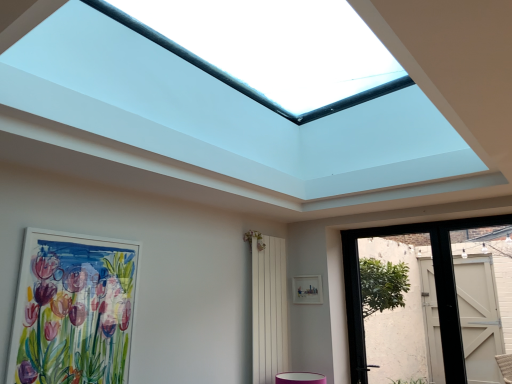
Question: Can you confirm if white matte picture frame at center, placed as the second picture frame when sorted from left to right, is wider than white painted wood door at right, which is counted as the second door, starting from the left?

Choices:
 (A) no
 (B) yes

Answer: (A)

Question: Is the position of white matte picture frame at center, placed as the second picture frame when sorted from left to right, more distant than that of white painted wood door at right, the first door positioned from the right?

Choices:
 (A) no
 (B) yes

Answer: (B)

Question: Does white matte picture frame at center, placed as the second picture frame when sorted from left to right, have a greater height compared to white painted wood door at right, the first door positioned from the right?

Choices:
 (A) yes
 (B) no

Answer: (B)

Question: Is white painted wood door at right, which is counted as the second door, starting from the left, a part of white matte picture frame at center, the second picture frame positioned from the front?

Choices:
 (A) no
 (B) yes

Answer: (A)

Question: Is white matte picture frame at center, the first picture frame viewed from the back, thinner than white painted wood door at right, which is counted as the second door, starting from the left?

Choices:
 (A) yes
 (B) no

Answer: (A)

Question: Considering the positions of white painted wood door at right, the first door positioned from the right, and white matte picture frame at center, placed as the second picture frame when sorted from left to right, in the image, is white painted wood door at right, the first door positioned from the right, wider or thinner than white matte picture frame at center, placed as the second picture frame when sorted from left to right,?

Choices:
 (A) wide
 (B) thin

Answer: (A)

Question: Based on their sizes in the image, would you say white painted wood door at right, the first door positioned from the right, is bigger or smaller than white matte picture frame at center, placed as the second picture frame when sorted from left to right?

Choices:
 (A) big
 (B) small

Answer: (A)

Question: Is white painted wood door at right, the first door positioned from the right, in front of or behind white matte picture frame at center, the second picture frame positioned from the front, in the image?

Choices:
 (A) front
 (B) behind

Answer: (A)

Question: Would you say white painted wood door at right, which is counted as the second door, starting from the left, is inside or outside white matte picture frame at center, the second picture frame positioned from the front?

Choices:
 (A) inside
 (B) outside

Answer: (B)

Question: Looking at the image, does white matte picture frame at center, the first picture frame viewed from the back, seem bigger or smaller compared to pink fabric flower at center?

Choices:
 (A) big
 (B) small

Answer: (B)

Question: Is white matte picture frame at center, placed as the second picture frame when sorted from left to right, taller or shorter than pink fabric flower at center?

Choices:
 (A) tall
 (B) short

Answer: (A)

Question: From the image's perspective, relative to pink fabric flower at center, is white matte picture frame at center, positioned as the 1th picture frame in right-to-left order, above or below?

Choices:
 (A) above
 (B) below

Answer: (B)

Question: From a real-world perspective, is white matte picture frame at center, placed as the second picture frame when sorted from left to right, positioned above or below pink fabric flower at center?

Choices:
 (A) below
 (B) above

Answer: (A)

Question: Would you say matte black door at right, the 2th door viewed from the right, is inside or outside matte white picture frame at left, acting as the 2th picture frame starting from the back?

Choices:
 (A) outside
 (B) inside

Answer: (A)

Question: In terms of height, does matte black door at right, the first door positioned from the left, look taller or shorter compared to matte white picture frame at left, marked as the second picture frame in a right-to-left arrangement?

Choices:
 (A) tall
 (B) short

Answer: (A)